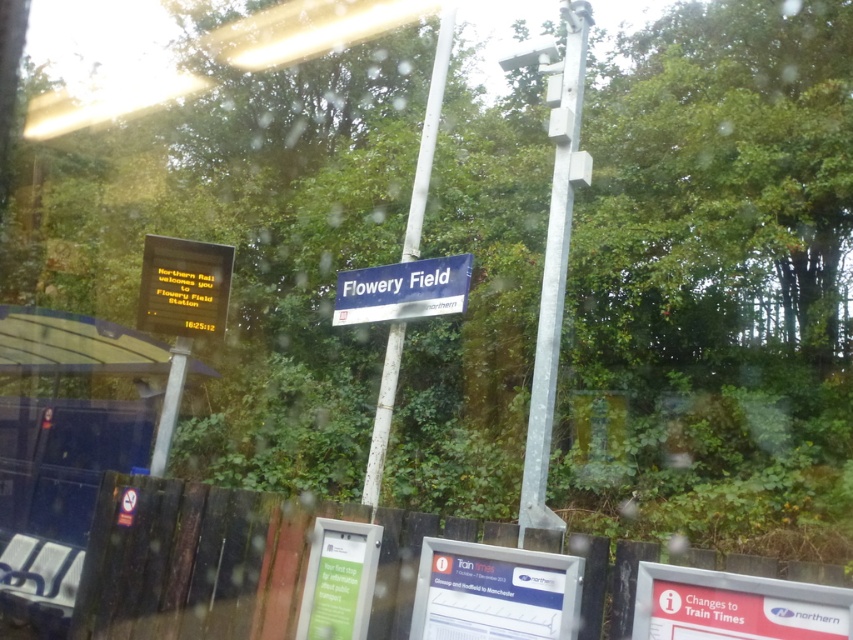
You are standing at the train station and want to sit down. There is a wooden bench at left. Is the wooden bench at left located to the left or right of the point marked at coordinate (x=62, y=449)?

The point marked at coordinate (x=62, y=449) corresponds to the wooden bench at left, so the wooden bench at left is located exactly at that point.

You are a passenger waiting for your train and want to sit down. You see a wooden bench at left and a galvanized metal pole at upper right. Which object can you sit on?

The wooden bench at left is bigger than the galvanized metal pole at upper right, so you can sit on the wooden bench at left.

You are a passenger trying to read both the white plastic sign at lower right and the yellow digital display at upper left at the Flowery Field station. Which one is located to the right side of the other?

The white plastic sign at lower right is positioned on the right side of yellow digital display at upper left.